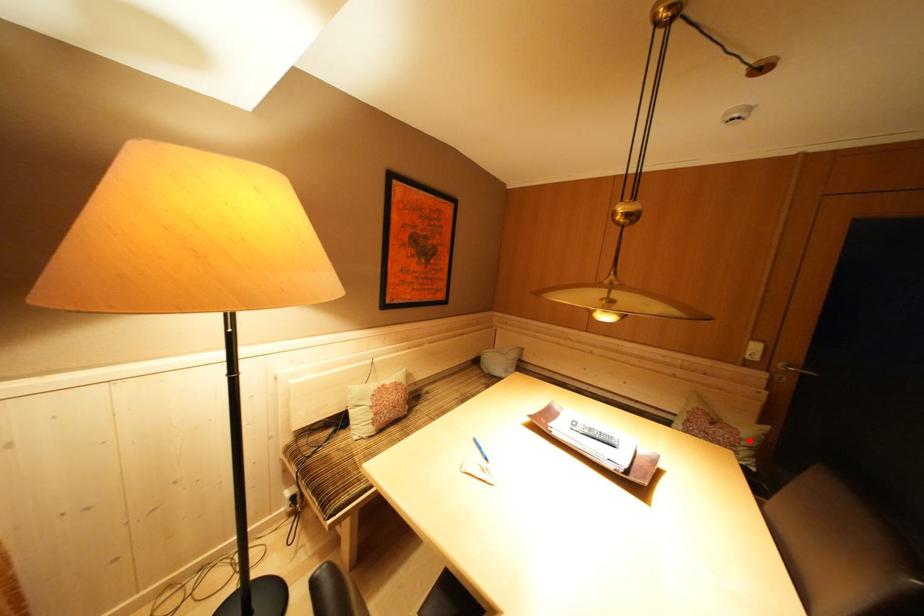
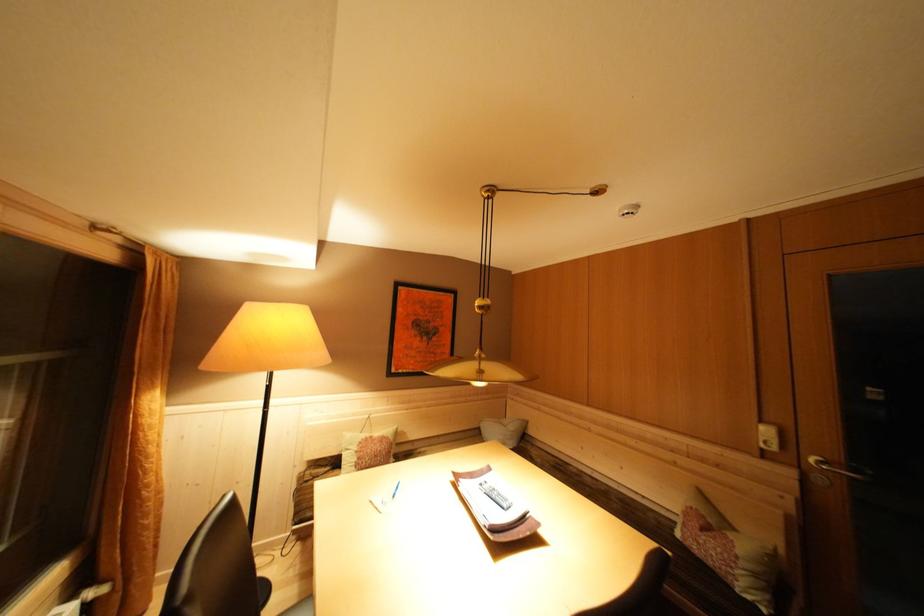
Find the pixel in the second image that matches the highlighted location in the first image.

(746, 557)